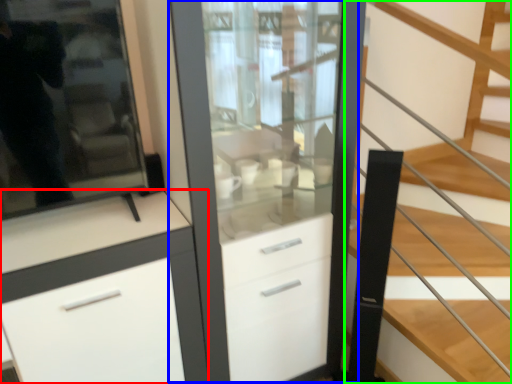
Question: Which is nearer to the cabinetry (highlighted by a red box)? dresser (highlighted by a blue box) or stairs (highlighted by a green box).

Choices:
 (A) dresser
 (B) stairs

Answer: (A)